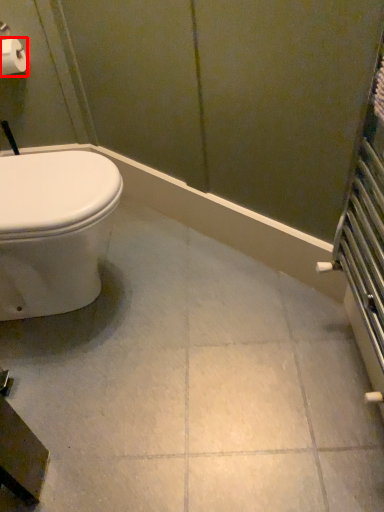
Question: From the image's perspective, where is toilet paper (annotated by the red box) located in relation to ceramic tile in the image?

Choices:
 (A) above
 (B) below

Answer: (A)